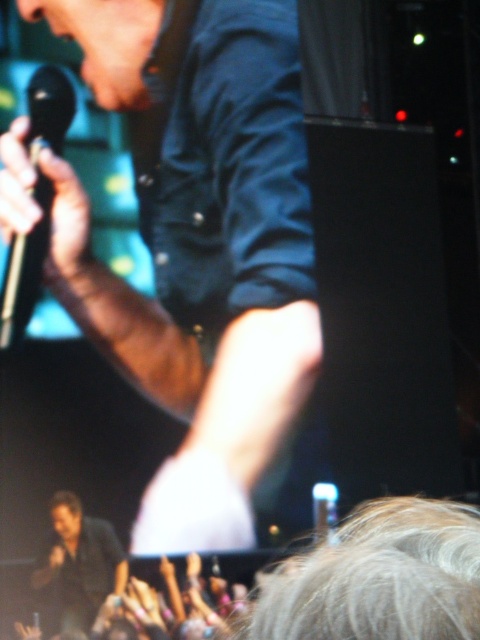
You are a stagehand needing to place a 30 inch long cable between the matte black microphone at upper left and the black metallic microphone at left. Is the space between them sufficient for the cable to fit without bending?

The distance between the matte black microphone at upper left and the black metallic microphone at left is 32.12 inches, which is longer than the 30 inch cable. Therefore, the cable can fit comfortably without bending.

You are a photographer at the concert. You want to capture a photo that includes both the matte black microphone at upper left and the dark blue shirt at lower left. Based on their positions, which object should you focus on first to ensure both are in frame?

The matte black microphone at upper left is located above the dark blue shirt at lower left. To ensure both are in frame, focus on the matte black microphone at upper left first since it is higher up, allowing the camera to include the dark blue shirt at lower left in the lower part of the photo.